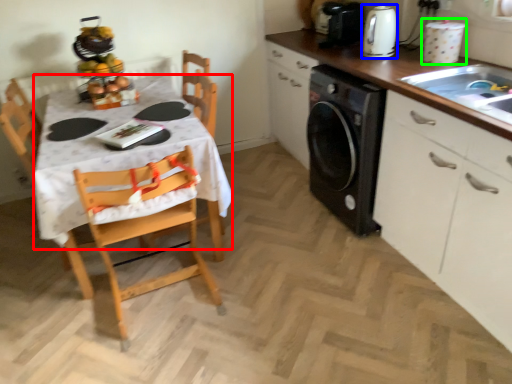
Question: Which object is positioned closest to tablecloth (highlighted by a red box)? Select from kitchen appliance (highlighted by a blue box) and appliance (highlighted by a green box).

Choices:
 (A) kitchen appliance
 (B) appliance

Answer: (A)